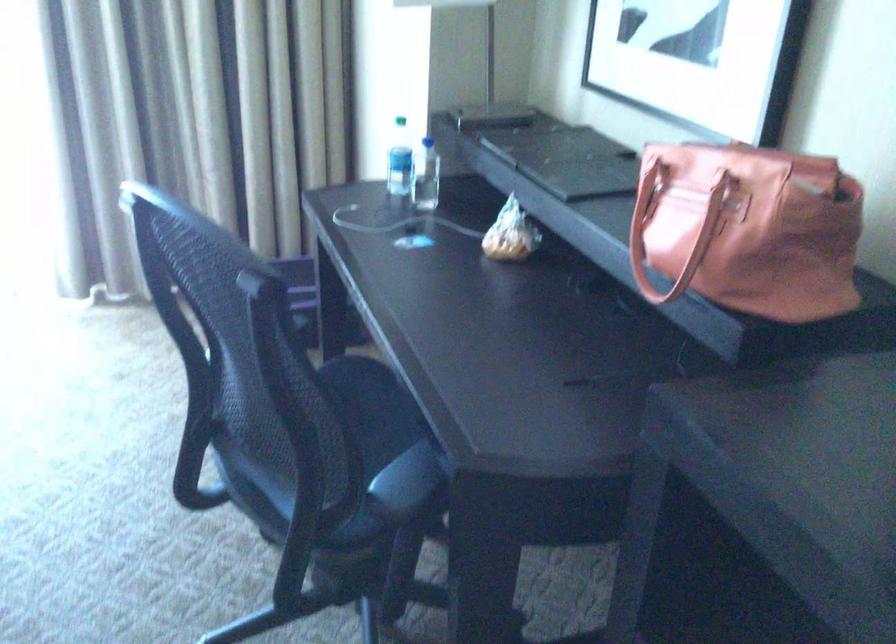
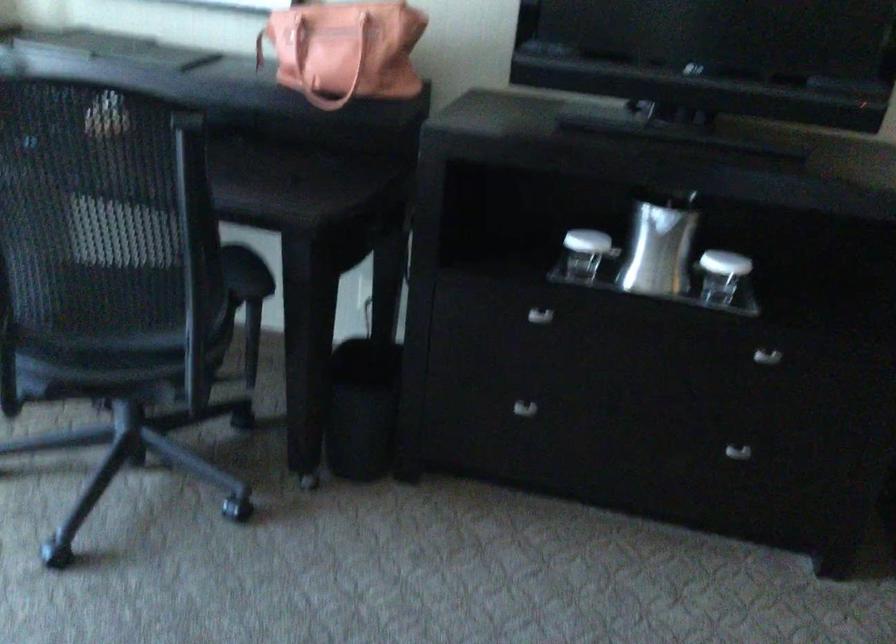
Locate, in the second image, the point that corresponds to pixel 662 223 in the first image.

(315, 57)